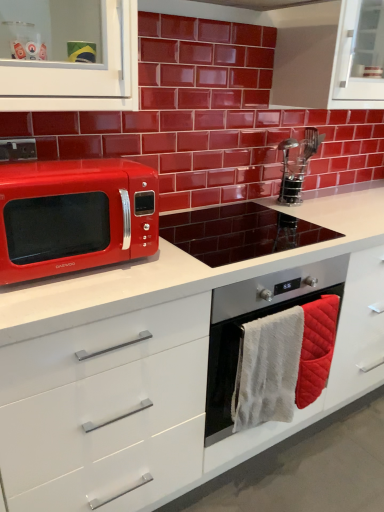
Locate an element on the screen. This screenshot has width=384, height=512. stainless steel oven at center is located at coordinates [238, 232].

What do you see at coordinates (75, 216) in the screenshot? I see `shiny red microwave at left` at bounding box center [75, 216].

Find the location of a particular element. stainless steel oven at center is located at coordinates (238, 232).

Which point is more distant from viewer, (98, 153) or (243, 408)?

Positioned behind is point (98, 153).

Based on their positions, is glossy ceramic microwave at left located to the left or right of white textured hand towel at center, which appears as the 2th hand towel when viewed from the right?

glossy ceramic microwave at left is to the right of white textured hand towel at center, which appears as the 2th hand towel when viewed from the right.

Is glossy ceramic microwave at left not inside white textured hand towel at center, which appears as the 2th hand towel when viewed from the right?

Yes.

Which of these two, glossy ceramic microwave at left or white textured hand towel at center, positioned as the first hand towel in left-to-right order, stands taller?

Standing taller between the two is glossy ceramic microwave at left.

Can you tell me how much stainless steel oven at center and quilted cotton hand towel at lower right, the second hand towel positioned from the left, differ in facing direction?

0.194 degrees separate the facing orientations of stainless steel oven at center and quilted cotton hand towel at lower right, the second hand towel positioned from the left.

From a real-world perspective, is stainless steel oven at center beneath quilted cotton hand towel at lower right, the second hand towel positioned from the left?

Incorrect, from a real-world perspective, stainless steel oven at center is higher than quilted cotton hand towel at lower right, the second hand towel positioned from the left.

Between stainless steel oven at center and quilted cotton hand towel at lower right, the second hand towel positioned from the left, which one appears on the right side from the viewer's perspective?

quilted cotton hand towel at lower right, the second hand towel positioned from the left.

Would you say stainless steel oven at center is outside quilted cotton hand towel at lower right, the second hand towel positioned from the left?

Yes, stainless steel oven at center is not within quilted cotton hand towel at lower right, the second hand towel positioned from the left.

Is stainless steel oven at center closer to the viewer compared to shiny red microwave at left?

No.

Which is behind, point (280, 233) or point (4, 250)?

The point (280, 233) is farther from the camera.

I want to click on appliance on the right of shiny red microwave at left, so click(x=238, y=232).

How different are the orientations of stainless steel oven at center and shiny red microwave at left in degrees?

The facing directions of stainless steel oven at center and shiny red microwave at left are 0.00147 degrees apart.

From the image's perspective, who appears lower, stainless steel oven at center or shiny red microwave at left?

stainless steel oven at center, from the image's perspective.

Is the surface of stainless steel oven at center in direct contact with shiny red microwave at left?

No, stainless steel oven at center is not in contact with shiny red microwave at left.

From a real-world perspective, which is physically below, quilted cotton hand towel at lower right, the second hand towel positioned from the left, or stainless steel oven at center?

quilted cotton hand towel at lower right, the second hand towel positioned from the left, from a real-world perspective.

Do you think quilted cotton hand towel at lower right, the first hand towel viewed from the right, is within stainless steel oven at center, or outside of it?

The correct answer is: inside.

Is quilted cotton hand towel at lower right, the second hand towel positioned from the left, to the right of stainless steel oven at center from the viewer's perspective?

Yes.

Looking at this image, is shiny red microwave at left oriented away from white glossy countertop at center?

shiny red microwave at left is not turned away from white glossy countertop at center.

Is shiny red microwave at left surrounding white glossy countertop at center?

That's incorrect, white glossy countertop at center is not inside shiny red microwave at left.

Is shiny red microwave at left to the right of white glossy countertop at center from the viewer's perspective?

No.

Is point (56, 238) positioned after point (361, 321)?

No, it is in front of (361, 321).

From the image's perspective, does white glossy countertop at center appear lower than shiny red microwave at left?

Yes.

Is point (114, 402) more distant than point (24, 225)?

Yes, it is behind point (24, 225).

How different are the orientations of white glossy countertop at center and shiny red microwave at left in degrees?

The angle between the facing direction of white glossy countertop at center and the facing direction of shiny red microwave at left is 0.00263 degrees.

The width and height of the screenshot is (384, 512). In order to click on the 1st hand towel behind the glossy ceramic microwave at left, starting your count from the anchor in this screenshot , I will do `click(268, 369)`.

Which hand towel is the 2nd one when counting from the right side of the stainless steel oven at center? Please provide its 2D coordinates.

[(316, 348)]

Considering their positions, is shiny red microwave at left positioned closer to white glossy countertop at center than quilted cotton hand towel at lower right, the second hand towel positioned from the left?

Among the two, shiny red microwave at left is located nearer to white glossy countertop at center.

From the image, which object appears to be farther from quilted cotton hand towel at lower right, the first hand towel viewed from the right, shiny red microwave at left or stainless steel oven at center?

shiny red microwave at left is further to quilted cotton hand towel at lower right, the first hand towel viewed from the right.

Looking at the image, which one is located closer to stainless steel oven at center, stainless steel oven at center or shiny red microwave at left?

Among the two, stainless steel oven at center is located nearer to stainless steel oven at center.

Which object lies further to the anchor point quilted cotton hand towel at lower right, the first hand towel viewed from the right, shiny red microwave at left or glossy ceramic microwave at left?

glossy ceramic microwave at left is further to quilted cotton hand towel at lower right, the first hand towel viewed from the right.

From the picture: When comparing their distances from white textured hand towel at center, positioned as the first hand towel in left-to-right order, does stainless steel oven at center or quilted cotton hand towel at lower right, the first hand towel viewed from the right, seem closer?

quilted cotton hand towel at lower right, the first hand towel viewed from the right, is closer to white textured hand towel at center, positioned as the first hand towel in left-to-right order.

Based on their spatial positions, is white glossy countertop at center or stainless steel oven at center closer to quilted cotton hand towel at lower right, the first hand towel viewed from the right?

Among the two, stainless steel oven at center is located nearer to quilted cotton hand towel at lower right, the first hand towel viewed from the right.

Based on their spatial positions, is quilted cotton hand towel at lower right, the second hand towel positioned from the left, or stainless steel oven at center closer to stainless steel oven at center?

quilted cotton hand towel at lower right, the second hand towel positioned from the left, is closer to stainless steel oven at center.

From the picture: When comparing their distances from stainless steel oven at center, does white glossy countertop at center or stainless steel oven at center seem further?

white glossy countertop at center lies further to stainless steel oven at center than the other object.

Identify the location of microwave oven between glossy ceramic microwave at left and quilted cotton hand towel at lower right, the second hand towel positioned from the left, vertically. (75, 216).

This screenshot has width=384, height=512. I want to click on oven located between shiny red microwave at left and white glossy countertop at center in the left-right direction, so click(253, 320).

Where is `brick between shiny red microwave at left and white glossy countertop at center`? This screenshot has height=512, width=384. brick between shiny red microwave at left and white glossy countertop at center is located at coordinates (209, 119).

Where is `appliance located between shiny red microwave at left and white textured hand towel at center, which appears as the 2th hand towel when viewed from the right, in the left-right direction`? The image size is (384, 512). appliance located between shiny red microwave at left and white textured hand towel at center, which appears as the 2th hand towel when viewed from the right, in the left-right direction is located at coordinates (238, 232).